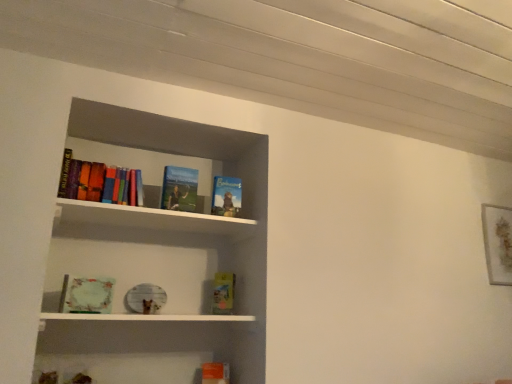
Question: From a real-world perspective, is matte green book at lower left, acting as the 4th book starting from the top, physically located above or below hardcover book at center, marked as the 2th book in a bottom-to-top arrangement?

Choices:
 (A) below
 (B) above

Answer: (A)

Question: Is matte green book at lower left, acting as the 4th book starting from the top, taller or shorter than hardcover book at center, marked as the 2th book in a bottom-to-top arrangement?

Choices:
 (A) tall
 (B) short

Answer: (B)

Question: Considering the real-world distances, which object is farthest from the orange matte book at lower center, the 1th book ordered from the bottom?

Choices:
 (A) multicolored hardcover books at upper left, the first book when ordered from top to bottom
 (B) hardcover book at upper center, marked as the second book in a top-to-bottom arrangement
 (C) hardcover book at upper center, arranged as the 4th book when ordered from the bottom
 (D) hardcover book at center, marked as the 2th book in a bottom-to-top arrangement
 (E) matte green book at lower left, which ranks as the 3th book in bottom-to-top order

Answer: (A)

Question: Estimate the real-world distances between objects in this image. Which object is farther from the hardcover book at center, marked as the 2th book in a bottom-to-top arrangement?

Choices:
 (A) multicolored hardcover books at upper left, the first book when ordered from top to bottom
 (B) matte green book at lower left, acting as the 4th book starting from the top
 (C) orange matte book at lower center, the 1th book ordered from the bottom
 (D) hardcover book at upper center, which appears as the fifth book when ordered from the bottom
 (E) hardcover book at upper center, acting as the 3th book starting from the top

Answer: (A)